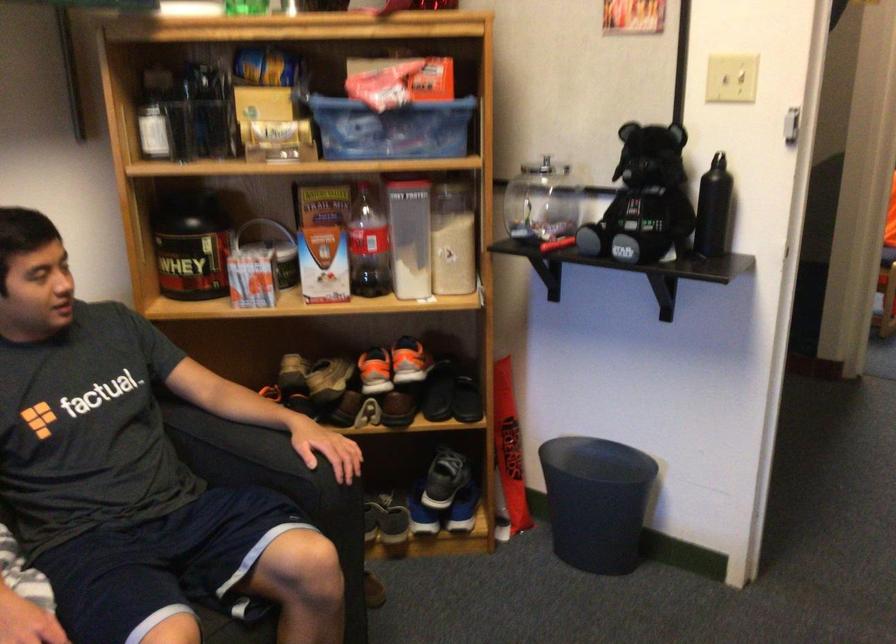
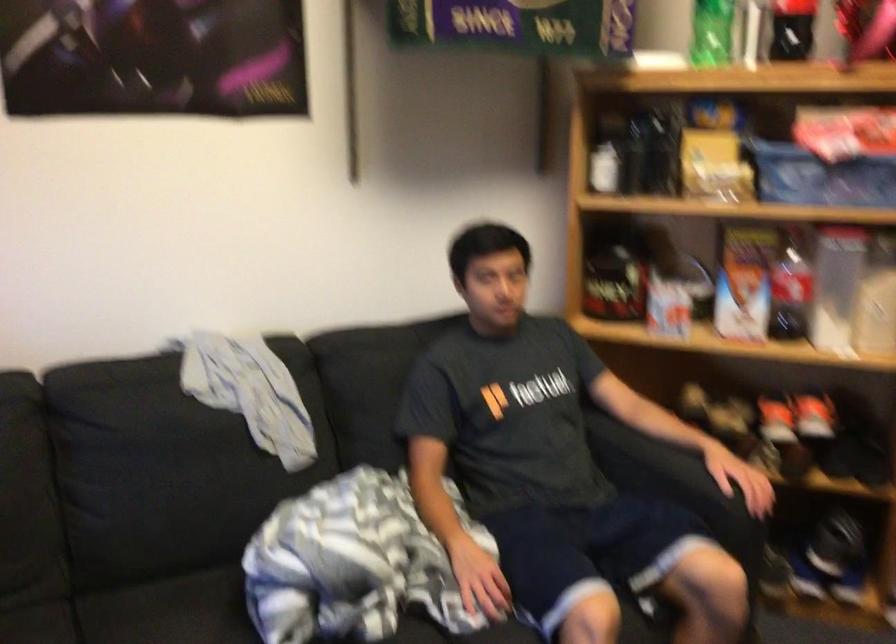
The point at (159,111) is marked in the first image. Where is the corresponding point in the second image?

(607, 154)